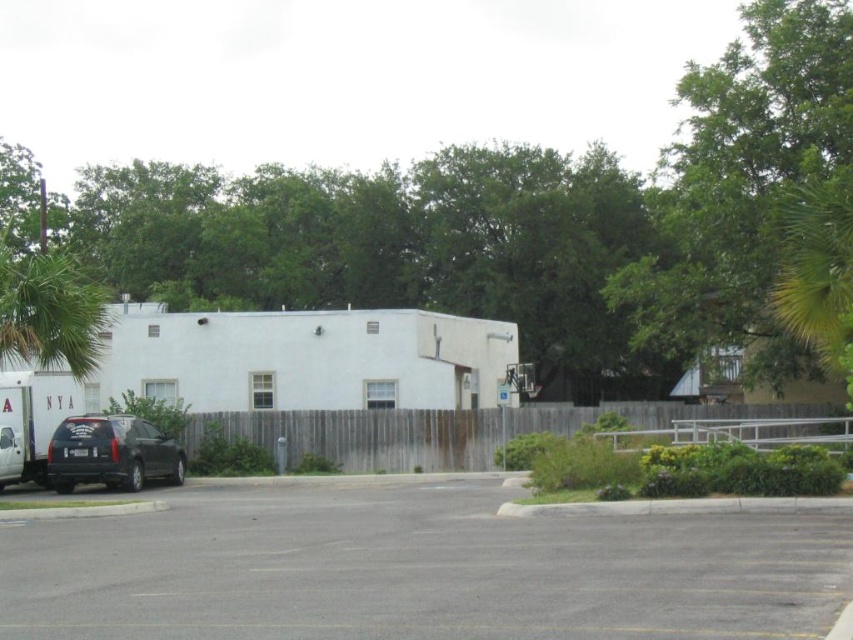
Who is shorter, green leafy tree at upper right or matte black suv at lower left?

With less height is matte black suv at lower left.

Does green leafy tree at upper right appear under matte black suv at lower left?

Actually, green leafy tree at upper right is above matte black suv at lower left.

The image size is (853, 640). I want to click on green leafy tree at upper right, so click(x=741, y=188).

Who is shorter, green leafy tree at upper right or green leafy palm tree at left?

With less height is green leafy palm tree at left.

Can you confirm if green leafy tree at upper right is positioned above green leafy palm tree at left?

Yes, green leafy tree at upper right is above green leafy palm tree at left.

In order to click on green leafy tree at upper right in this screenshot , I will do `click(741, 188)`.

In order to click on green leafy tree at upper right in this screenshot , I will do `click(741, 188)`.

Describe the element at coordinates (48, 310) in the screenshot. I see `green leafy palm tree at left` at that location.

Is point (26, 282) closer to viewer compared to point (67, 465)?

Yes, it is.

Where is `green leafy palm tree at left`? This screenshot has height=640, width=853. green leafy palm tree at left is located at coordinates (48, 310).